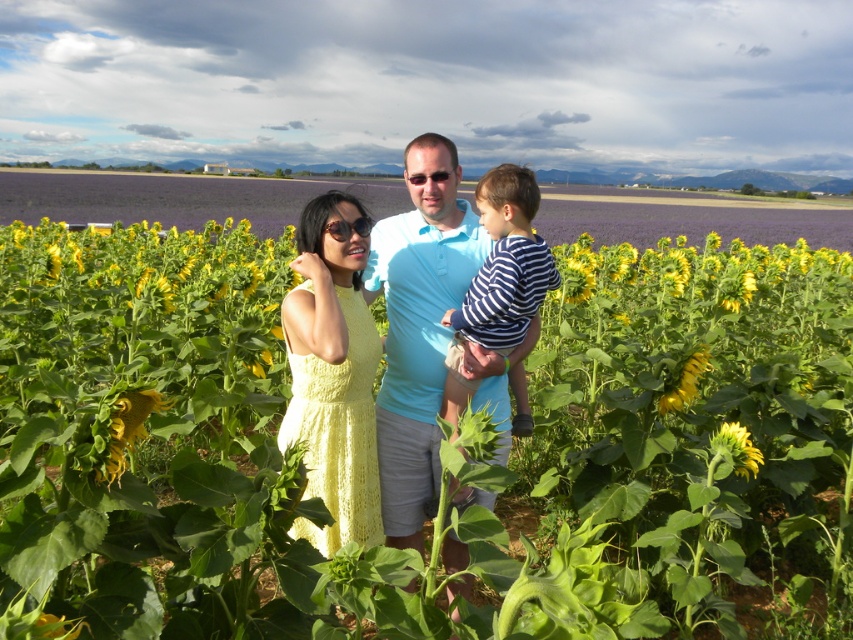
You are a photographer trying to capture a photo of the family in the sunflower field. You notice the yellow knitted dress at center and striped cotton shirt at center. Which clothing item appears narrower in the photo?

The yellow knitted dress at center appears narrower than the striped cotton shirt at center in the photo.